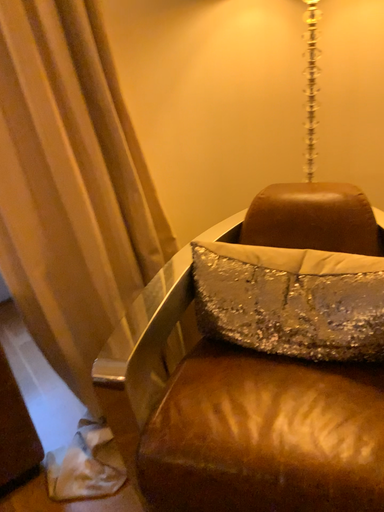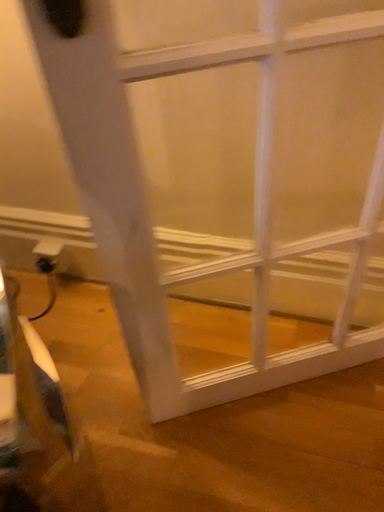
Question: How did the camera likely rotate when shooting the video?

Choices:
 (A) rotated right
 (B) rotated left

Answer: (A)